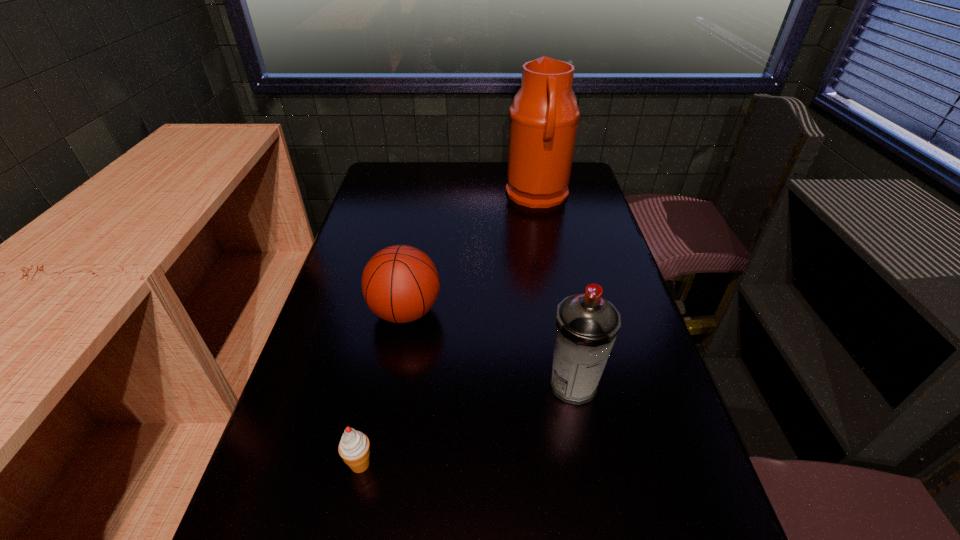
Locate an element on the screen. free space located from the spout of the tallest object is located at coordinates (456, 195).

The height and width of the screenshot is (540, 960). Identify the location of free region located on the back of the second tallest object. (564, 336).

I want to click on vacant position located 0.160m on the back of the third nearest object, so click(416, 252).

Where is `free space located 0.180m on the right of the shortest object`? The width and height of the screenshot is (960, 540). free space located 0.180m on the right of the shortest object is located at coordinates (469, 464).

You are a GUI agent. You are given a task and a screenshot of the screen. Output one action in this format:
    pyautogui.click(x=<x>, y=<y>)
    Task: Click on the object that is at the far edge
    
    Given the screenshot: What is the action you would take?
    pyautogui.click(x=544, y=115)

Locate an element on the screen. basketball present at the left edge is located at coordinates (400, 283).

Identify the location of icecream present at the left edge. This screenshot has width=960, height=540. [354, 448].

Identify the location of water jug that is positioned at the right edge. This screenshot has height=540, width=960. (544, 115).

This screenshot has width=960, height=540. Find the location of `aerosol can that is at the right edge`. aerosol can that is at the right edge is located at coordinates (587, 325).

Find the location of a particular element. This screenshot has width=960, height=540. object situated at the far right corner is located at coordinates (544, 115).